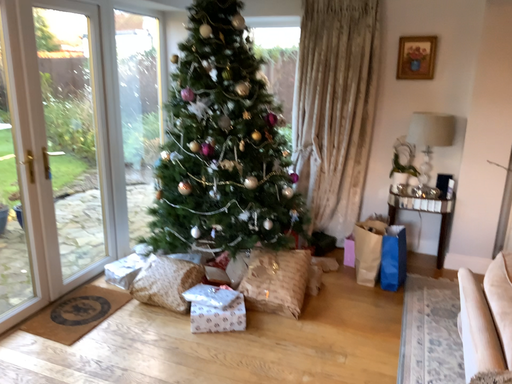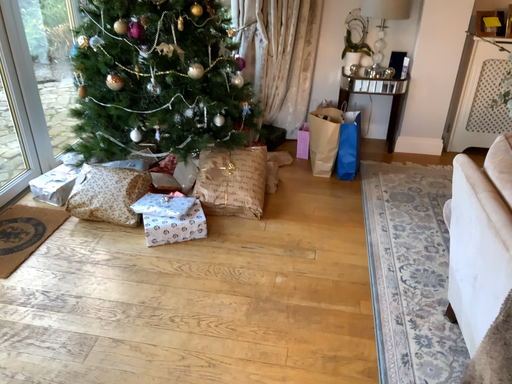
Question: Which way did the camera rotate in the video?

Choices:
 (A) rotated upward
 (B) rotated downward

Answer: (B)